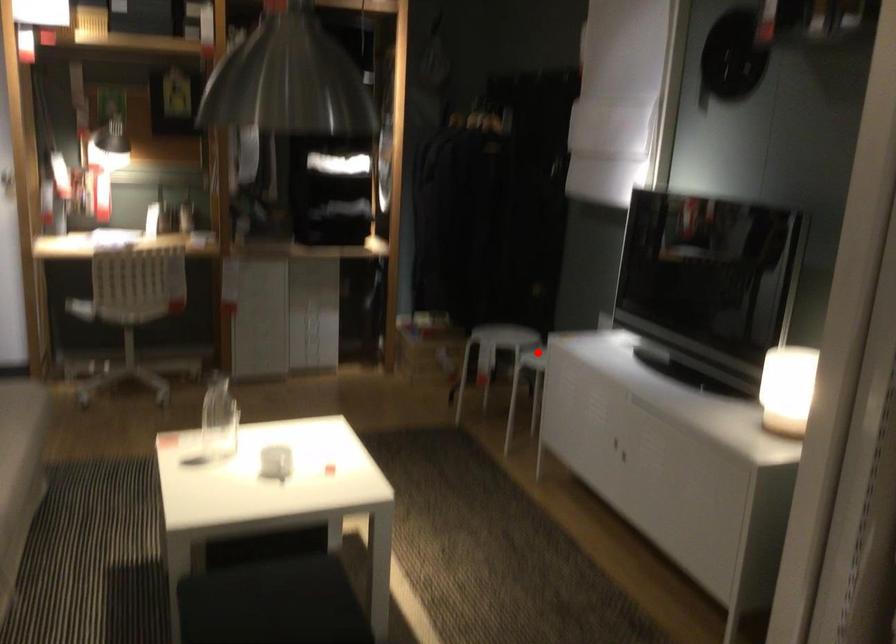
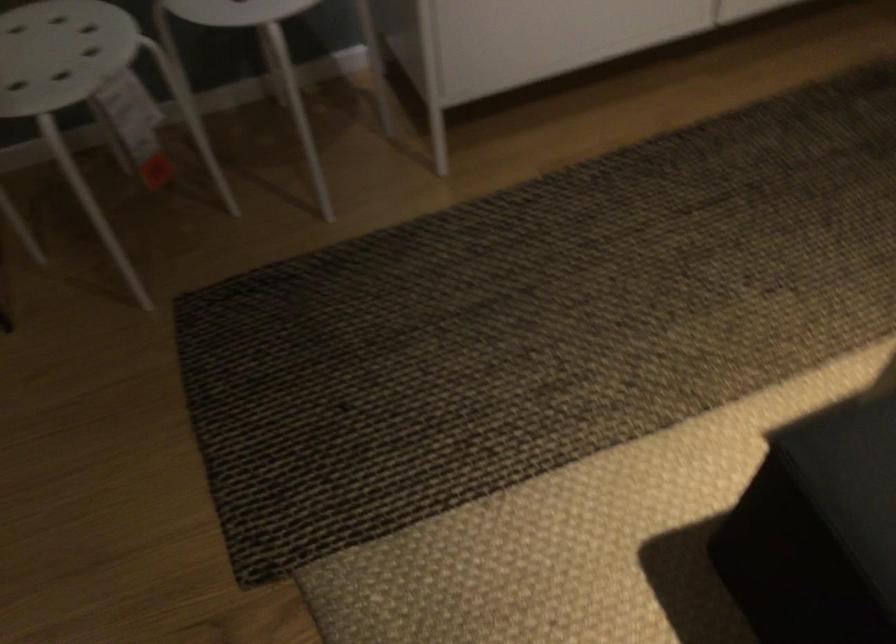
Locate, in the second image, the point that corresponds to the highlighted location in the first image.

(235, 11)